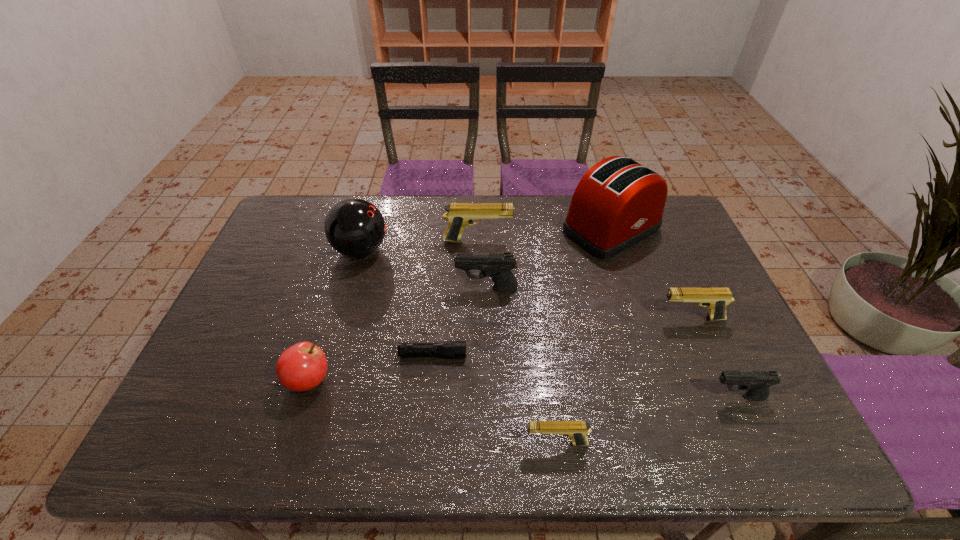
This screenshot has width=960, height=540. Find the location of `free space between the second smallest tan pistol and the flashlight`. free space between the second smallest tan pistol and the flashlight is located at coordinates (562, 336).

This screenshot has height=540, width=960. Find the location of `free space between the biggest tan pistol and the second shortest object`. free space between the biggest tan pistol and the second shortest object is located at coordinates (517, 342).

The image size is (960, 540). Identify the location of free space between the smallest tan pistol and the second nearest tan pistol. (624, 381).

In order to click on vacant area that lies between the biggest tan pistol and the apple in this screenshot , I will do `click(394, 310)`.

At what (x,y) coordinates should I click in order to perform the action: click on free spot between the farthest tan pistol and the toaster. Please return your answer as a coordinate pair (x, y). The width and height of the screenshot is (960, 540). Looking at the image, I should click on (544, 235).

Find the location of a particular element. the sixth closest object to the third farthest pistol is located at coordinates (451, 349).

Locate which object ranks second in proximity to the farthest tan pistol. Please provide its 2D coordinates. Your answer should be formatted as a tuple, i.e. [(x, y)], where the tuple contains the x and y coordinates of a point satisfying the conditions above.

[(618, 202)]

Select which pistol is the closest to the eighth tallest object. Please provide its 2D coordinates. Your answer should be formatted as a tuple, i.e. [(x, y)], where the tuple contains the x and y coordinates of a point satisfying the conditions above.

[(757, 383)]

Identify the location of the fourth closest pistol to the shortest object. (716, 300).

Where is `tan pistol that is the third nearest to the eighth shortest object`? tan pistol that is the third nearest to the eighth shortest object is located at coordinates (716, 300).